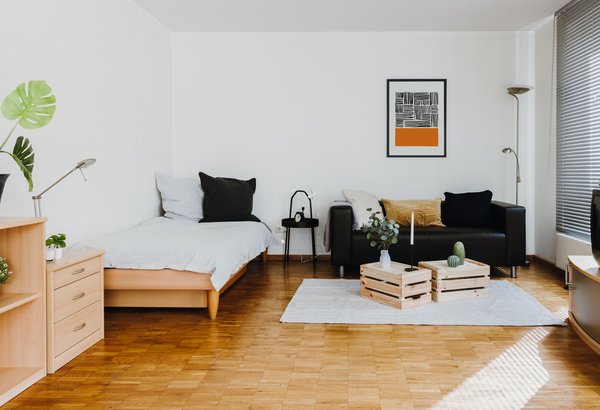
The width and height of the screenshot is (600, 410). Identify the location of venetian blinds. (571, 151).